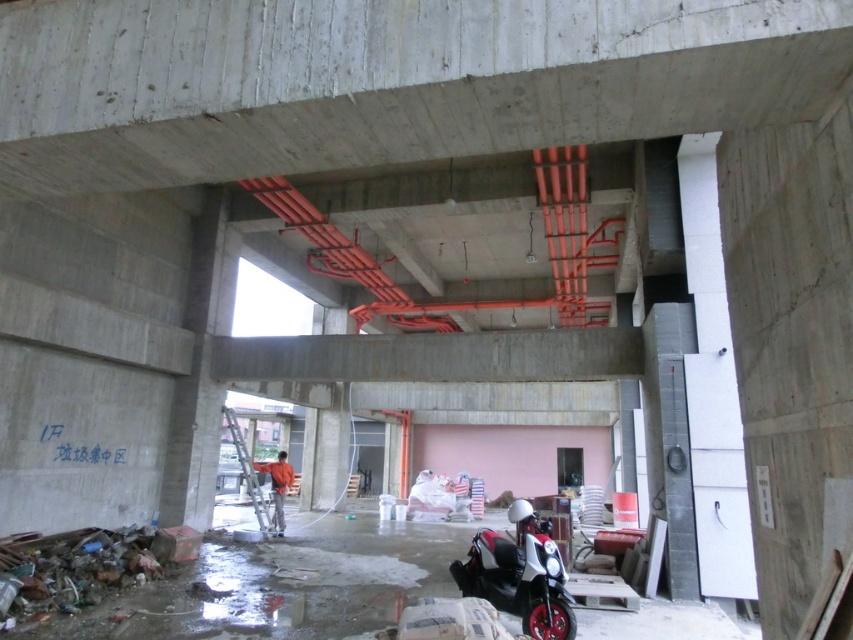
Does concrete at center lie in front of orange fabric man at center?

Yes, concrete at center is in front of orange fabric man at center.

Which is behind, point (235, 164) or point (283, 468)?

The point (283, 468) is more distant.

Image resolution: width=853 pixels, height=640 pixels. Identify the location of concrete at center. (384, 81).

Consider the image. Does white glossy scooter at center appear under orange fabric man at center?

No.

Does white glossy scooter at center appear on the right side of orange fabric man at center?

Yes, white glossy scooter at center is to the right of orange fabric man at center.

Who is more distant from viewer, (549,589) or (280,525)?

The point (280,525) is more distant.

Find the location of a particular element. white glossy scooter at center is located at coordinates (520, 573).

Does concrete at center have a greater width compared to white glossy scooter at center?

Yes.

Is point (84, 168) behind point (535, 580)?

No, (84, 168) is in front of (535, 580).

Where is `concrete at center`? The image size is (853, 640). concrete at center is located at coordinates (384, 81).